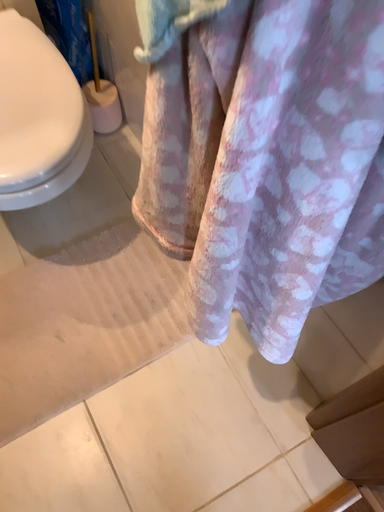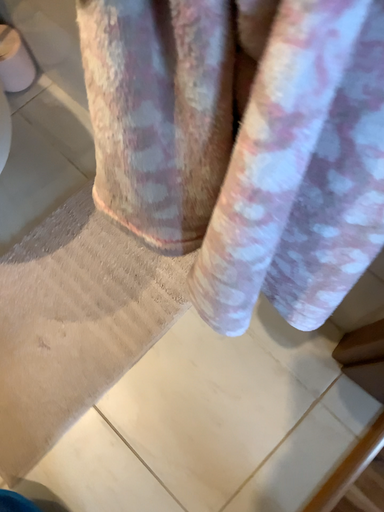
Question: Which way did the camera rotate in the video?

Choices:
 (A) rotated downward
 (B) rotated upward

Answer: (A)